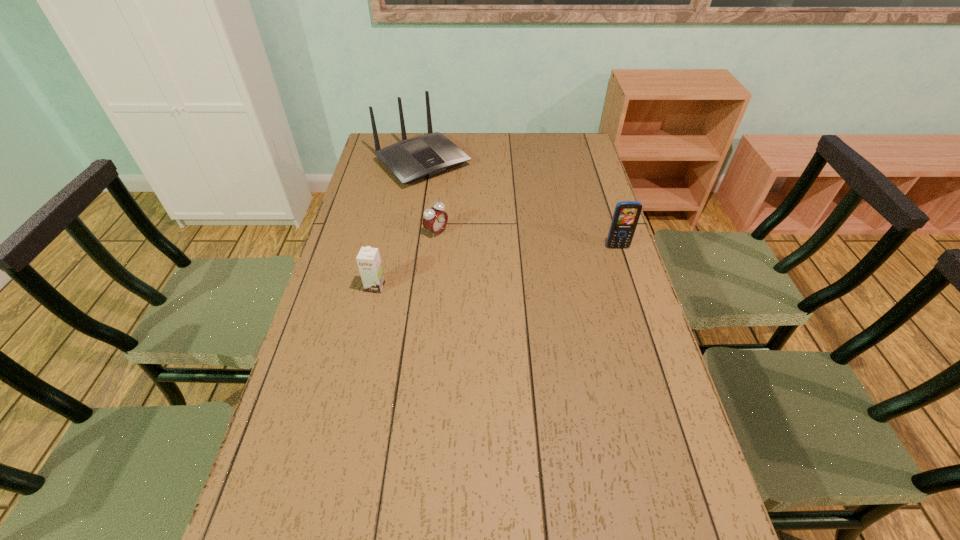
Where is `the third tallest object`? the third tallest object is located at coordinates (368, 259).

I want to click on the nearest object, so tap(368, 259).

Where is `cellular telephone`? Image resolution: width=960 pixels, height=540 pixels. cellular telephone is located at coordinates point(626,214).

What are the coordinates of `the third shortest object` in the screenshot? It's located at (626, 214).

You are a GUI agent. You are given a task and a screenshot of the screen. Output one action in this format:
    pyautogui.click(x=<x>, y=<y>)
    Task: Click on the shortest object
    This screenshot has width=960, height=540.
    Given the screenshot: What is the action you would take?
    pyautogui.click(x=435, y=219)

You are a GUI agent. You are given a task and a screenshot of the screen. Output one action in this format:
    pyautogui.click(x=<x>, y=<y>)
    Task: Click on the second farthest object
    Image resolution: width=960 pixels, height=540 pixels.
    Given the screenshot: What is the action you would take?
    pyautogui.click(x=435, y=219)

The height and width of the screenshot is (540, 960). In order to click on the tallest object in this screenshot , I will do `click(428, 155)`.

The width and height of the screenshot is (960, 540). Identify the location of router. (428, 155).

Where is `vacant space positioned on the front of the third tallest object`? Image resolution: width=960 pixels, height=540 pixels. vacant space positioned on the front of the third tallest object is located at coordinates (349, 404).

Locate an element on the screen. vacant space located 0.150m on the screen of the rightmost object is located at coordinates (629, 284).